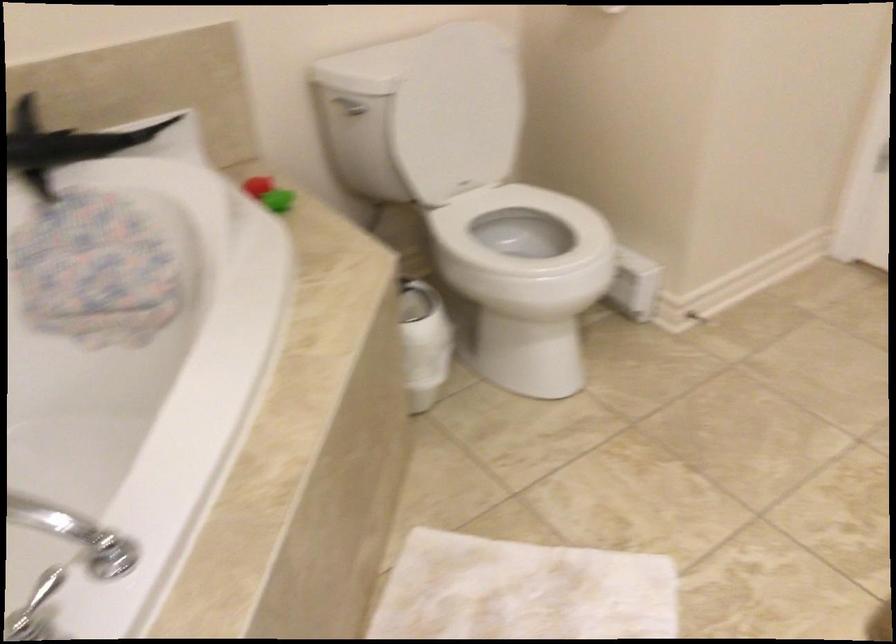
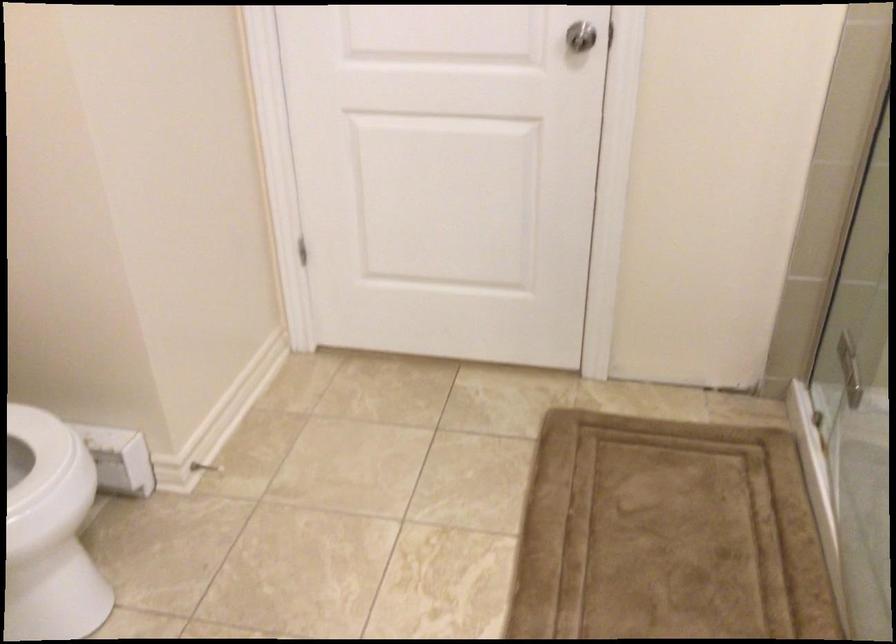
Question: The camera is either moving clockwise (left) or counter-clockwise (right) around the object. The first image is from the beginning of the video and the second image is from the end. Is the camera moving left or right when shooting the video?

Choices:
 (A) Left
 (B) Right

Answer: (A)